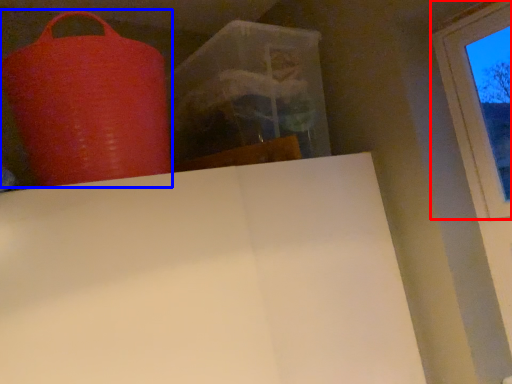
Question: Which point is closer to the camera, window (highlighted by a red box) or punching bag (highlighted by a blue box)?

Choices:
 (A) window
 (B) punching bag

Answer: (B)